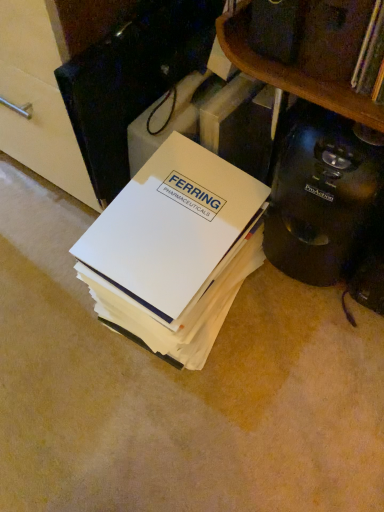
Identify the location of free space in front of white paper at center. (174, 422).